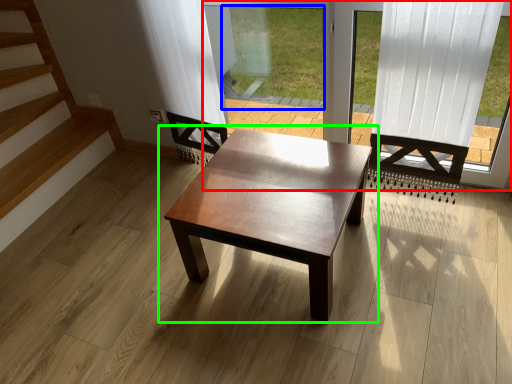
Question: Which object is the closest to the window frame (highlighted by a red box)? Choose among these: window screen (highlighted by a blue box) or coffee table (highlighted by a green box).

Choices:
 (A) window screen
 (B) coffee table

Answer: (A)